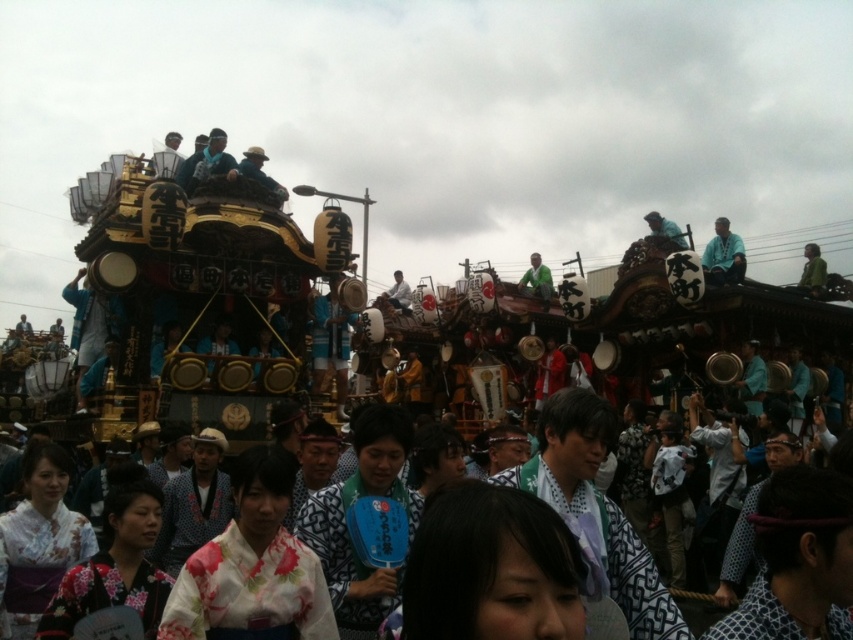
Does green fabric shirt at center appear under blue fabric hat at upper center?

Yes.

Is point (550, 288) in front of point (674, 225)?

No, it is behind (674, 225).

The image size is (853, 640). In order to click on green fabric shirt at center in this screenshot , I will do `click(537, 280)`.

Where is `floral kimono at center`? This screenshot has width=853, height=640. floral kimono at center is located at coordinates [252, 566].

Does floral kimono at center lie in front of blue fabric hat at upper center?

Yes, it is.

What are the coordinates of `floral kimono at center` in the screenshot? It's located at (252, 566).

Identify the location of floral kimono at center. Image resolution: width=853 pixels, height=640 pixels. (252, 566).

Based on the photo, does light blue fabric at upper right have a larger size compared to matte gold helmet at upper center?

Indeed, light blue fabric at upper right has a larger size compared to matte gold helmet at upper center.

You are a GUI agent. You are given a task and a screenshot of the screen. Output one action in this format:
    pyautogui.click(x=<x>, y=<y>)
    Task: Click on the light blue fabric at upper right
    This screenshot has height=640, width=853.
    Given the screenshot: What is the action you would take?
    pyautogui.click(x=723, y=256)